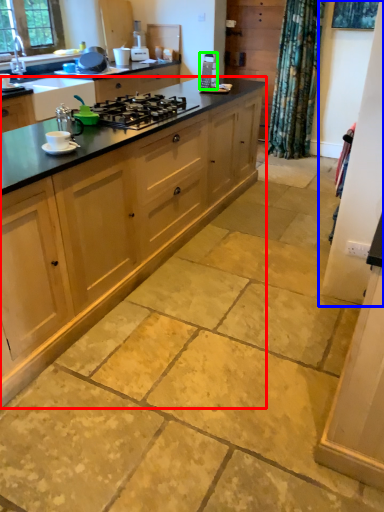
Question: Considering the real-world distances, which object is farthest from cabinetry (highlighted by a red box)? screen door (highlighted by a blue box) or appliance (highlighted by a green box)?

Choices:
 (A) screen door
 (B) appliance

Answer: (B)